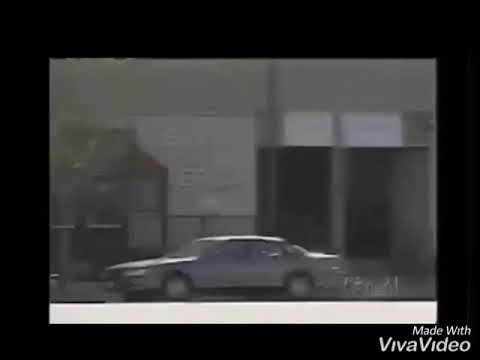
Where is `the left side door`? The image size is (480, 360). the left side door is located at coordinates (213, 270).